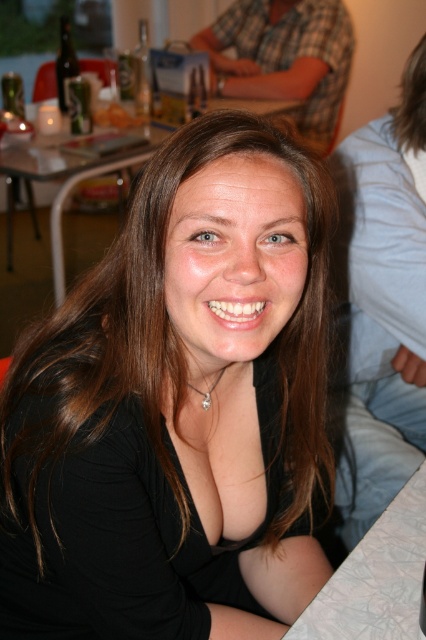
Looking at this image, which of these two, black matte shirt at center or white textured table at lower right, stands shorter?

white textured table at lower right is shorter.

Which is more to the right, black matte shirt at center or white textured table at lower right?

white textured table at lower right

Between point (227, 147) and point (400, 570), which one is positioned behind?

Point (400, 570)

The width and height of the screenshot is (426, 640). I want to click on black matte shirt at center, so click(178, 406).

Is point (403, 586) behind point (57, 156)?

No, it is not.

Who is lower down, white textured table at lower right or white glossy table at center?

white textured table at lower right is lower down.

Does point (403, 624) come in front of point (146, 154)?

Yes.

Find the location of a particular element. The height and width of the screenshot is (640, 426). white textured table at lower right is located at coordinates (376, 577).

Is black matte shirt at center positioned in front of white glossy table at center?

Yes, it is in front of white glossy table at center.

Does black matte shirt at center appear on the left side of white glossy table at center?

Incorrect, black matte shirt at center is not on the left side of white glossy table at center.

Which is in front, point (57, 465) or point (43, 163)?

Point (57, 465) is more forward.

At what (x,y) coordinates should I click in order to perform the action: click on black matte shirt at center. Please return your answer as a coordinate pair (x, y). Looking at the image, I should click on (178, 406).